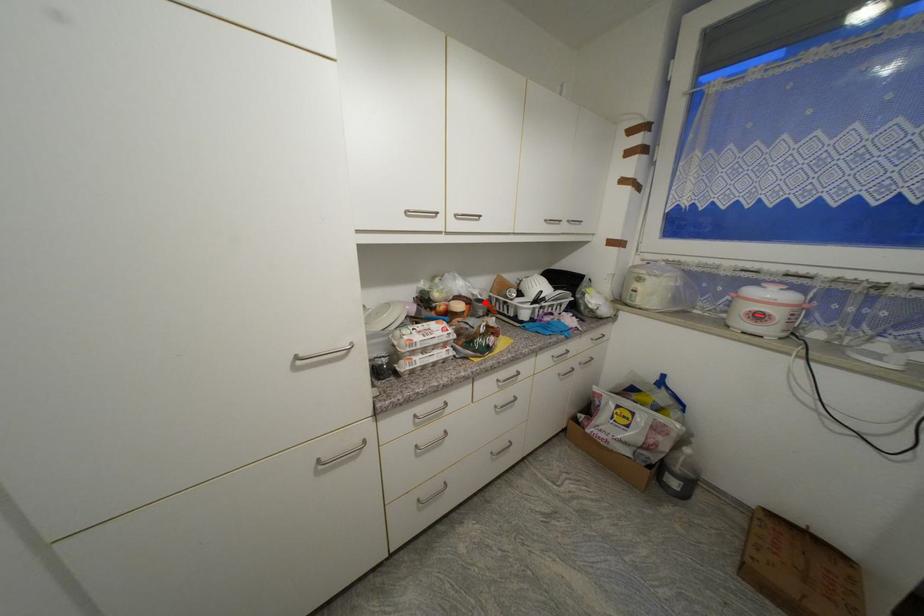
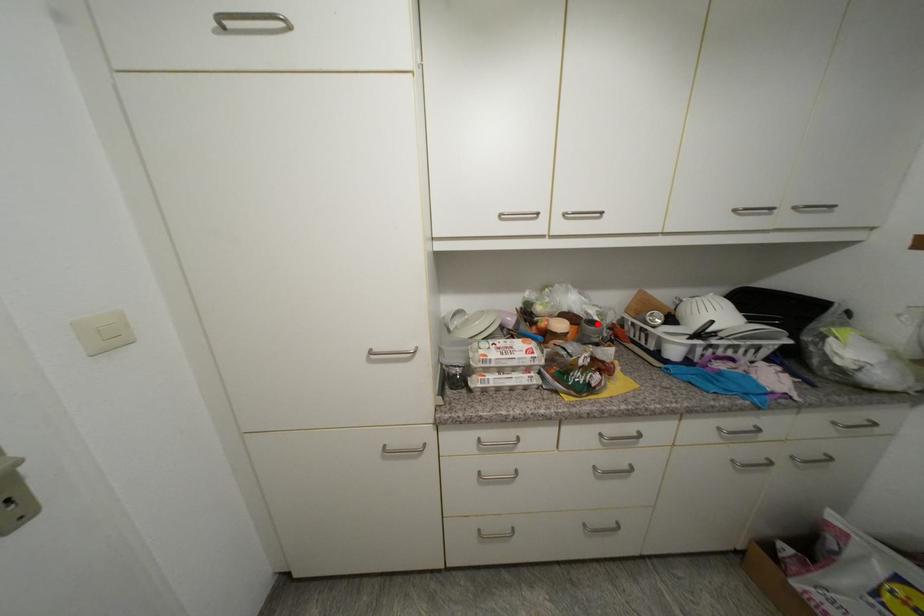
I am providing you with two images of the same scene from different viewpoints. A red point is marked on the first image and another point is marked on the second image. Does the point marked in image1 correspond to the same location as the one in image2?

Yes